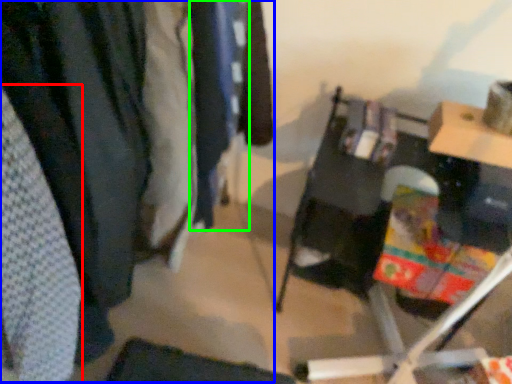
Question: Considering the real-world distances, which object is farthest from clothing (highlighted by a red box)? closet (highlighted by a blue box) or clothing (highlighted by a green box)?

Choices:
 (A) closet
 (B) clothing

Answer: (B)